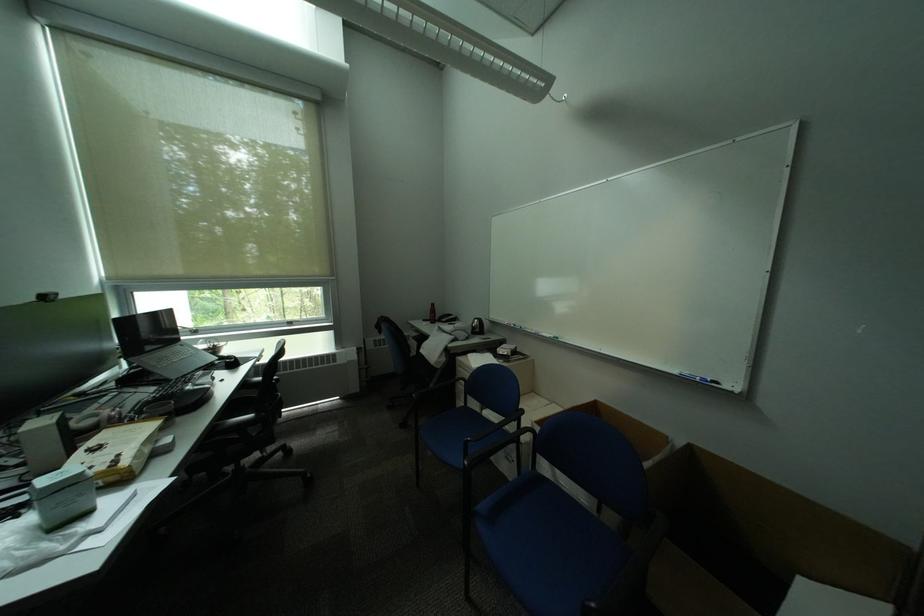
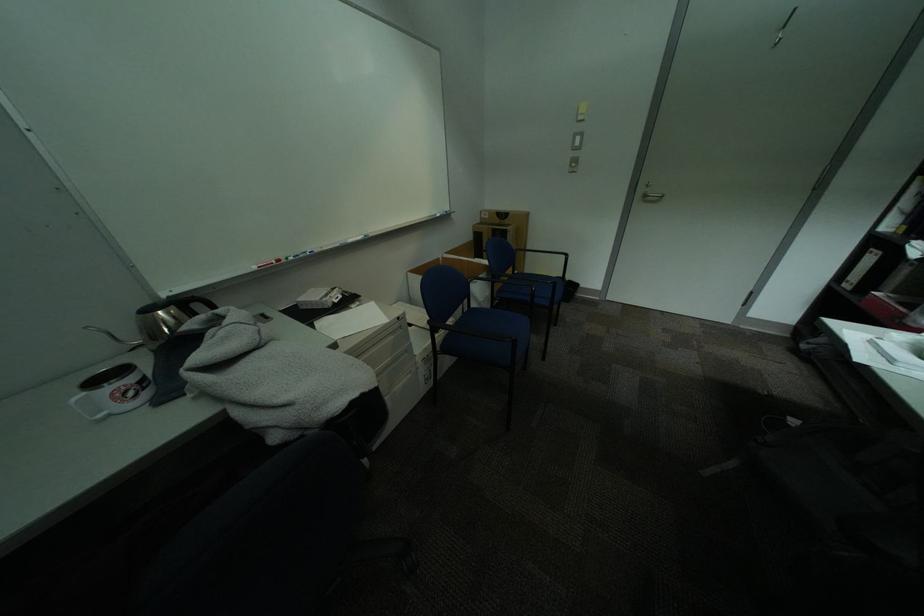
Locate, in the second image, the point that corresponds to the point at 492,322 in the first image.

(204, 297)